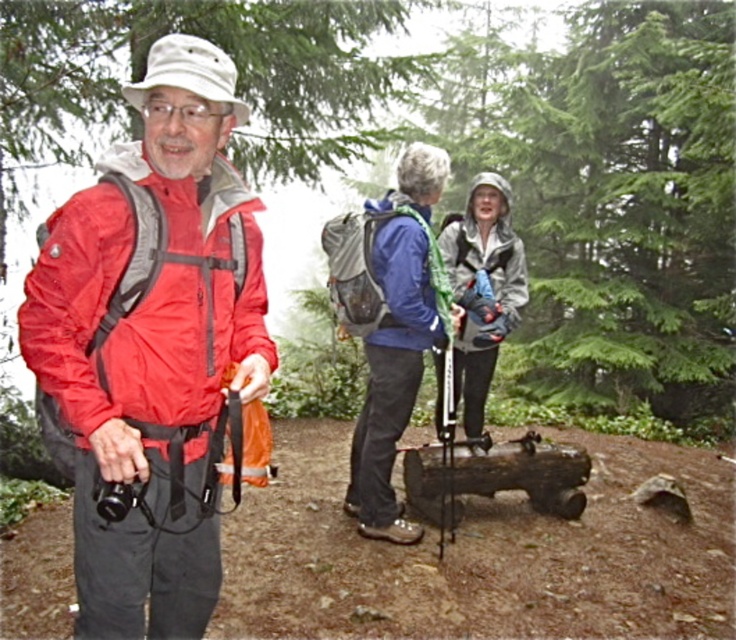
Based on the scene description, which object is positioned to the left of the other between the matte nylon jacket at left and the blue matte jacket at center?

The matte nylon jacket at left is positioned to the left of the blue matte jacket at center.

In the scene shown: You are a photographer trying to capture a photo of both the matte nylon jacket at left and the blue matte jacket at center. Based on their positions, which jacket should you focus on first to ensure both are in clear view?

The matte nylon jacket at left is closer to the viewer than the blue matte jacket at center. To ensure both are in clear view, focus on the matte nylon jacket at left first as it is closer, allowing the camera to adjust the depth of field to include the farther blue matte jacket at center.

What are the coordinates of the matte nylon jacket at left in the image?

The coordinates of the matte nylon jacket at left are at point (145,298).